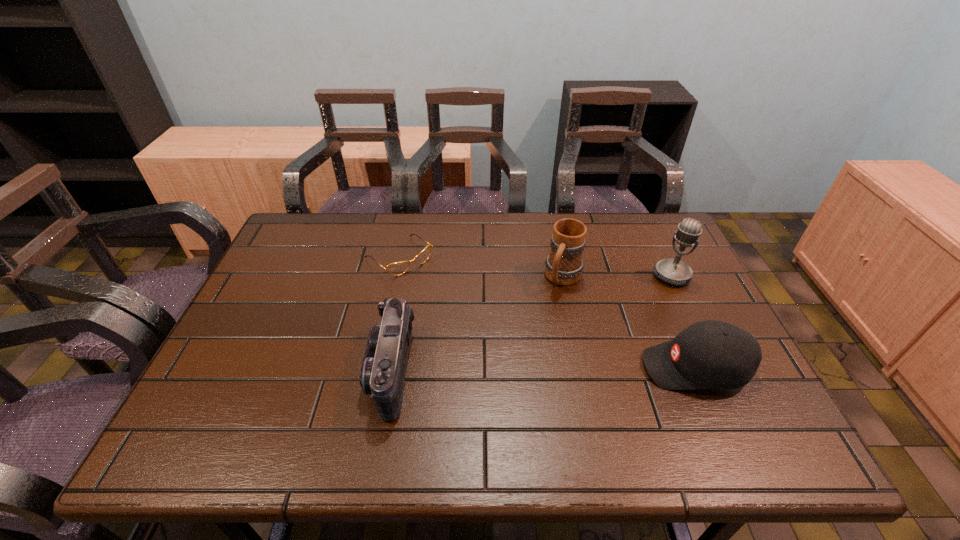
At what (x,y) coordinates should I click in order to perform the action: click on vacant region between the camcorder and the fourth shortest object. Please return your answer as a coordinate pair (x, y). The width and height of the screenshot is (960, 540). Looking at the image, I should click on (477, 324).

The image size is (960, 540). What are the coordinates of `unoccupied position between the camcorder and the mug` in the screenshot? It's located at pyautogui.click(x=477, y=324).

Point out which object is positioned as the third nearest to the spectacles. Please provide its 2D coordinates. Your answer should be formatted as a tuple, i.e. [(x, y)], where the tuple contains the x and y coordinates of a point satisfying the conditions above.

[(710, 354)]

The image size is (960, 540). I want to click on object that is the fourth closest one to the fourth shortest object, so click(x=383, y=370).

Identify the location of vacant area that satisfies the following two spatial constraints: 1. on the front side of the mug; 2. on the right side of the spectacles. This screenshot has width=960, height=540. (396, 278).

Where is `vacant position in the image that satisfies the following two spatial constraints: 1. on the front side of the microphone; 2. on the right side of the spectacles`? This screenshot has width=960, height=540. vacant position in the image that satisfies the following two spatial constraints: 1. on the front side of the microphone; 2. on the right side of the spectacles is located at coordinates point(396,276).

The image size is (960, 540). Identify the location of free space that satisfies the following two spatial constraints: 1. on the front side of the mug; 2. on the right side of the spectacles. (396, 278).